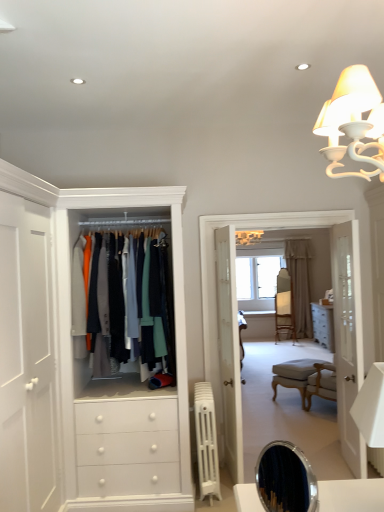
Question: In terms of height, does wooden floor at center look taller or shorter compared to white glass door at right?

Choices:
 (A) tall
 (B) short

Answer: (A)

Question: Is wooden floor at center bigger or smaller than white glass door at right?

Choices:
 (A) big
 (B) small

Answer: (A)

Question: Based on their relative distances, which object is farther from the white leather ottoman at lower right?

Choices:
 (A) white plastic radiator at center
 (B) wooden floor at center
 (C) white glass door at right
 (D) beige fabric curtain at center
 (E) matte fabric jackets at center

Answer: (D)

Question: Estimate the real-world distances between objects in this image. Which object is farther from the beige fabric curtain at center?

Choices:
 (A) white plastic radiator at center
 (B) white glass door at right
 (C) wooden floor at center
 (D) wooden armchair at center
 (E) matte fabric jackets at center

Answer: (E)